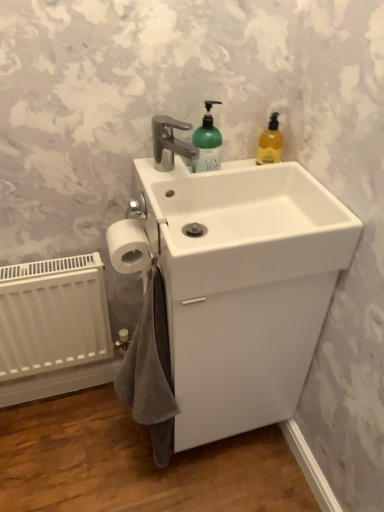
You are a GUI agent. You are given a task and a screenshot of the screen. Output one action in this format:
    pyautogui.click(x=<x>, y=<y>)
    Task: Click on the free location in front of white glossy sink at center
    Image resolution: width=384 pixels, height=512 pixels.
    Given the screenshot: What is the action you would take?
    pyautogui.click(x=225, y=483)